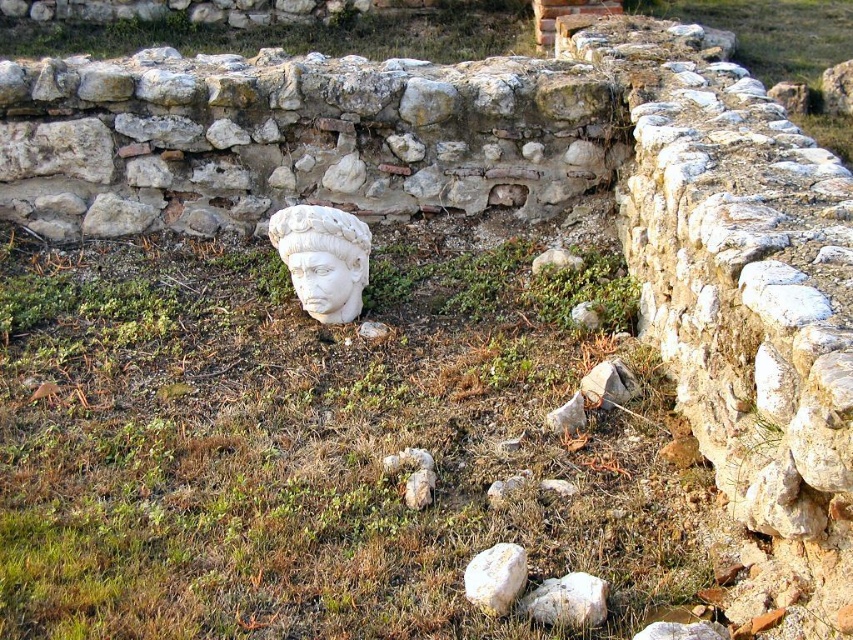
Question: Which point is closer to the camera?

Choices:
 (A) white marble bust at center
 (B) white marble rock at lower center

Answer: (B)

Question: Can you confirm if white marble stone at center is positioned below white marble rock at lower center?

Choices:
 (A) no
 (B) yes

Answer: (B)

Question: Is white smooth rock at center closer to the viewer compared to white marble stone at center?

Choices:
 (A) yes
 (B) no

Answer: (A)

Question: Does green grass at center lie behind white marble rock at lower center?

Choices:
 (A) yes
 (B) no

Answer: (B)

Question: Which point is closer to the camera?

Choices:
 (A) white marble head at center
 (B) white smooth rock at center

Answer: (B)

Question: Which object appears closest to the camera in this image?

Choices:
 (A) white marble stone at center
 (B) white smooth rock at center
 (C) white marble bust at center

Answer: (B)